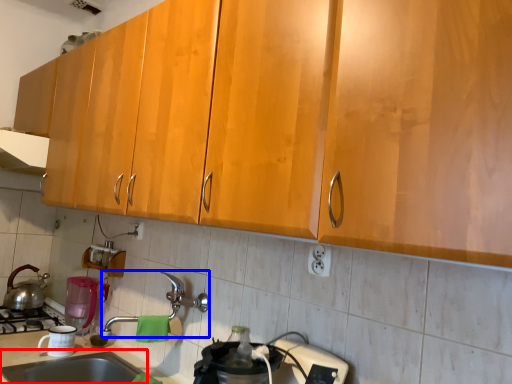
Question: Which object is closer to the camera taking this photo, sink (highlighted by a red box) or faucet (highlighted by a blue box)?

Choices:
 (A) sink
 (B) faucet

Answer: (A)